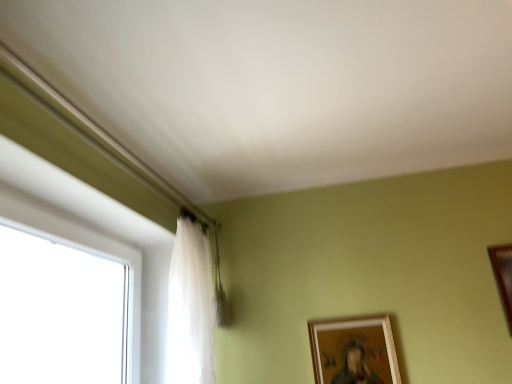
Question: Is wooden picture frame at lower right, arranged as the first picture frame when viewed from the left, further to camera compared to wooden picture frame at right, which is counted as the 1th picture frame, starting from the right?

Choices:
 (A) yes
 (B) no

Answer: (A)

Question: Does wooden picture frame at lower right, the 2th picture frame in the top-to-bottom sequence, come in front of wooden picture frame at right, which is counted as the 1th picture frame, starting from the right?

Choices:
 (A) yes
 (B) no

Answer: (B)

Question: From a real-world perspective, is wooden picture frame at lower right, arranged as the first picture frame when viewed from the left, under wooden picture frame at right, which is counted as the 1th picture frame, starting from the right?

Choices:
 (A) no
 (B) yes

Answer: (B)

Question: Is wooden picture frame at lower right, the 2th picture frame in the top-to-bottom sequence, oriented towards wooden picture frame at right, positioned as the 1th picture frame in top-to-bottom order?

Choices:
 (A) no
 (B) yes

Answer: (A)

Question: Is wooden picture frame at lower right, the 2th picture frame in the top-to-bottom sequence, taller than wooden picture frame at right, which is counted as the 1th picture frame, starting from the right?

Choices:
 (A) no
 (B) yes

Answer: (A)

Question: From a real-world perspective, is wooden picture frame at right, which ranks as the second picture frame in bottom-to-top order, positioned above or below translucent fabric curtain at left?

Choices:
 (A) below
 (B) above

Answer: (A)

Question: Considering the positions of point (510, 248) and point (198, 271), is point (510, 248) closer or farther from the camera than point (198, 271)?

Choices:
 (A) closer
 (B) farther

Answer: (A)

Question: Is wooden picture frame at right, positioned as the 1th picture frame in top-to-bottom order, situated inside translucent fabric curtain at left or outside?

Choices:
 (A) outside
 (B) inside

Answer: (A)

Question: Considering the positions of wooden picture frame at right, which is counted as the 1th picture frame, starting from the right, and translucent fabric curtain at left in the image, is wooden picture frame at right, which is counted as the 1th picture frame, starting from the right, bigger or smaller than translucent fabric curtain at left?

Choices:
 (A) small
 (B) big

Answer: (A)

Question: From their relative heights in the image, would you say translucent fabric curtain at left is taller or shorter than wooden picture frame at lower right, acting as the second picture frame starting from the right?

Choices:
 (A) tall
 (B) short

Answer: (A)

Question: In terms of size, does translucent fabric curtain at left appear bigger or smaller than wooden picture frame at lower right, acting as the second picture frame starting from the right?

Choices:
 (A) big
 (B) small

Answer: (A)

Question: Looking at their shapes, would you say translucent fabric curtain at left is wider or thinner than wooden picture frame at lower right, the 2th picture frame in the top-to-bottom sequence?

Choices:
 (A) thin
 (B) wide

Answer: (B)

Question: Would you say translucent fabric curtain at left is to the left or to the right of wooden picture frame at lower right, which appears as the first picture frame when ordered from the bottom, in the picture?

Choices:
 (A) left
 (B) right

Answer: (A)

Question: Is wooden picture frame at lower right, which appears as the first picture frame when ordered from the bottom, inside or outside of wooden picture frame at right, positioned as the 1th picture frame in top-to-bottom order?

Choices:
 (A) inside
 (B) outside

Answer: (B)

Question: From the image's perspective, is wooden picture frame at lower right, which appears as the first picture frame when ordered from the bottom, located above or below wooden picture frame at right, which is counted as the second picture frame, starting from the left?

Choices:
 (A) below
 (B) above

Answer: (A)